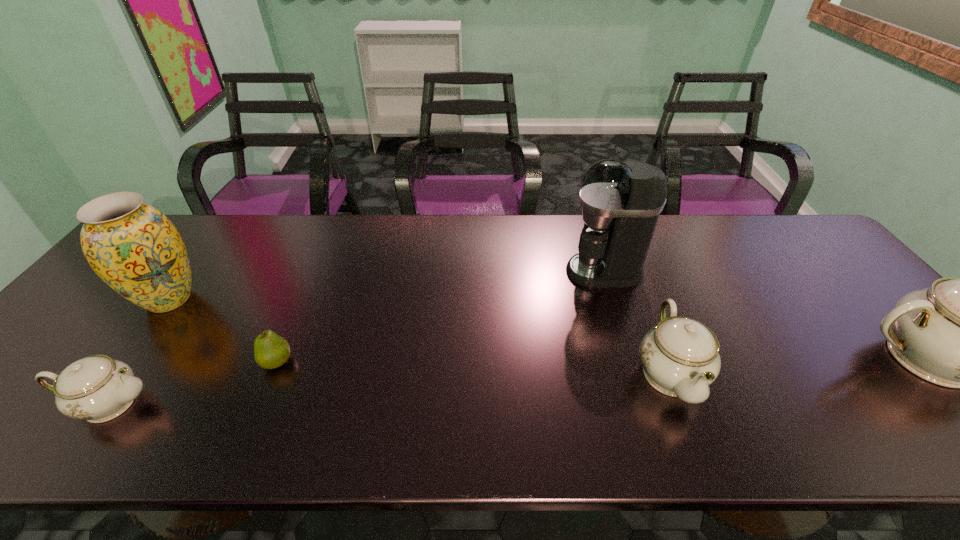
Locate an element on the screen. Image resolution: width=960 pixels, height=540 pixels. the shortest chinaware is located at coordinates (97, 388).

This screenshot has width=960, height=540. Identify the location of the second shortest object. (97, 388).

The height and width of the screenshot is (540, 960). What are the coordinates of `the second chinaware from left to right` in the screenshot? It's located at (680, 356).

Where is `the second shortest chinaware`? This screenshot has height=540, width=960. the second shortest chinaware is located at coordinates (680, 356).

At what (x,y) coordinates should I click in order to perform the action: click on coffee maker. Please return your answer as a coordinate pair (x, y). The image size is (960, 540). Looking at the image, I should click on (621, 202).

Identify the location of vase. This screenshot has height=540, width=960. (134, 248).

You are a GUI agent. You are given a task and a screenshot of the screen. Output one action in this format:
    pyautogui.click(x=<x>, y=<y>)
    Task: Click on the shortest object
    Image resolution: width=960 pixels, height=540 pixels.
    Given the screenshot: What is the action you would take?
    pyautogui.click(x=271, y=351)

Find the location of a particular element. The image size is (960, 540). the third object from left to right is located at coordinates (271, 351).

Identify the location of vacant space located 0.140m at the spout of the fifth tallest object. (219, 403).

The height and width of the screenshot is (540, 960). Identify the location of free spot located place cup under the spout of the coffee maker. (528, 272).